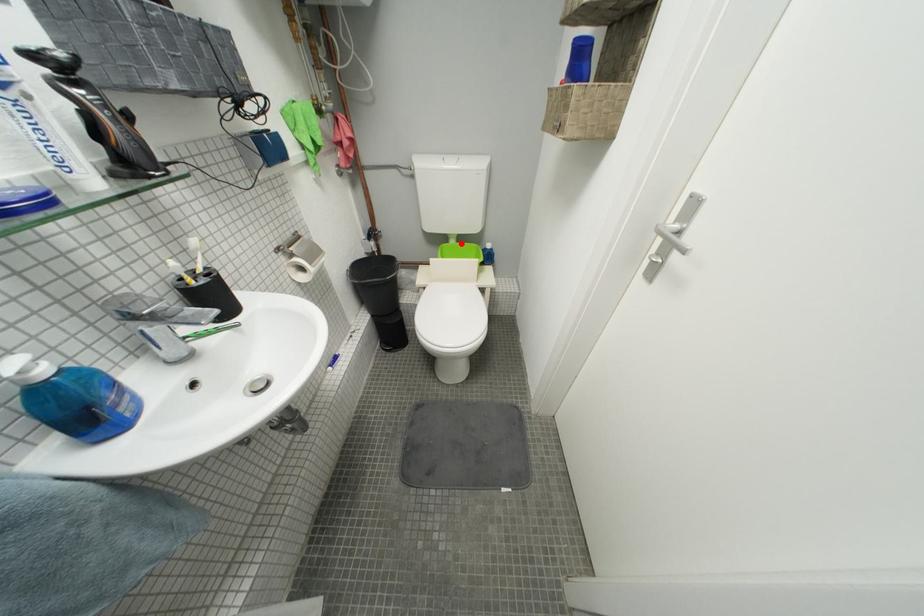
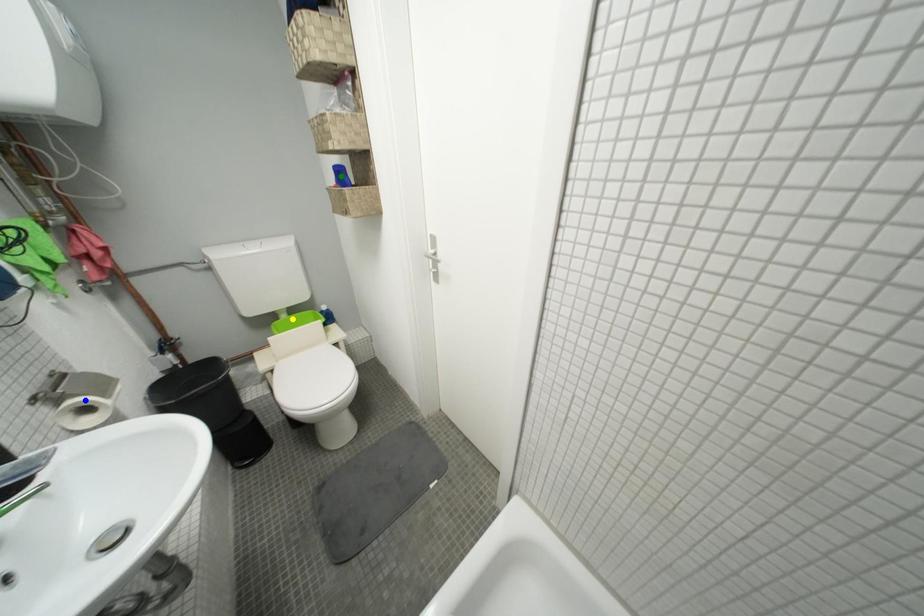
Question: I am providing you with two images of the same scene from different viewpoints. A red point is marked on the first image. You are given multiple points on the second image. Which mark in image 2 goes with the point in image 1?

Choices:
 (A) yellow point
 (B) blue point
 (C) green point

Answer: (A)